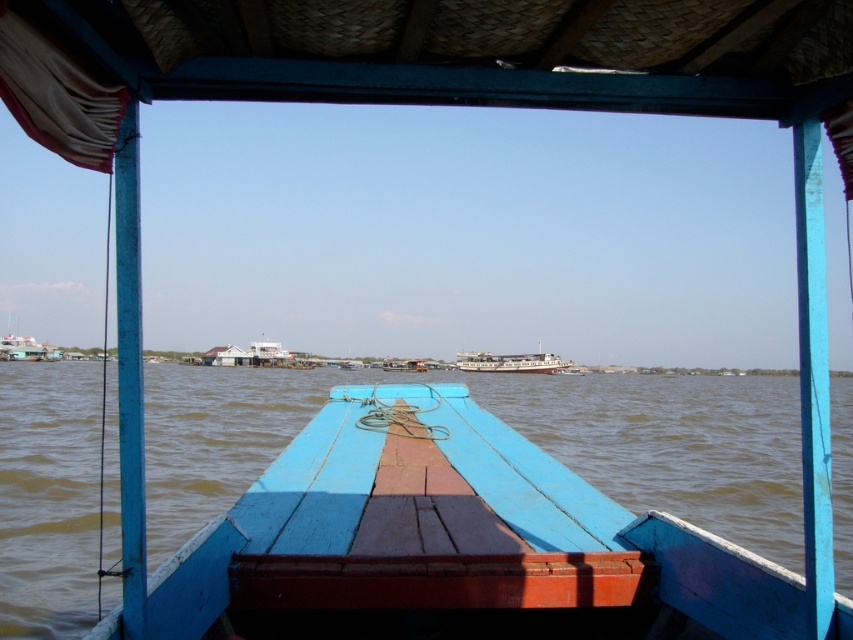
Question: Can you confirm if brown water at center is smaller than white glossy ship at center?

Choices:
 (A) yes
 (B) no

Answer: (B)

Question: Which object appears farthest from the camera in this image?

Choices:
 (A) brown water at center
 (B) white glossy ship at center

Answer: (B)

Question: Which point is farther to the camera?

Choices:
 (A) (492, 358)
 (B) (181, 513)

Answer: (A)

Question: Which of the following is the closest to the observer?

Choices:
 (A) (689, 516)
 (B) (534, 365)

Answer: (A)

Question: From the image, what is the correct spatial relationship of brown water at center in relation to white glossy ship at center?

Choices:
 (A) below
 (B) above

Answer: (B)

Question: Considering the relative positions of brown water at center and white glossy ship at center in the image provided, where is brown water at center located with respect to white glossy ship at center?

Choices:
 (A) above
 (B) below

Answer: (A)